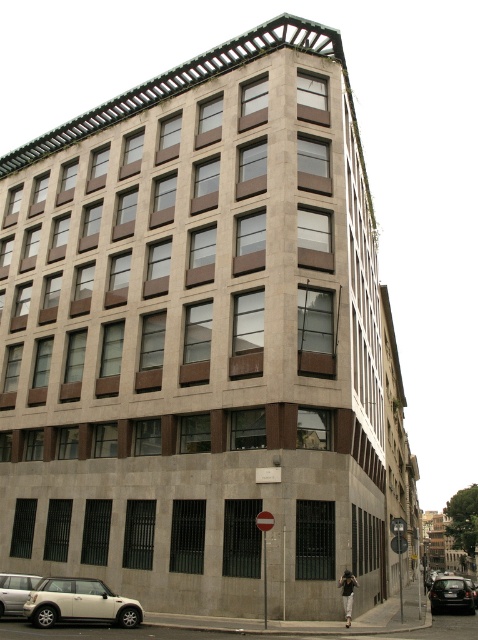
You are standing at the base of the multi story building and see the silver metallic car at lower left and the dark gray pants at lower right. Which object is nearer to you?

The silver metallic car at lower left is closer to the viewer than dark gray pants at lower right.

You are standing at the corner of the building and want to park your car. The parking spot is located at the point represented by point (14, 592). Which direction should you drive to reach the parking spot?

The parking spot is located at point (14, 592), which is at the lower left of the building. Since you are at the corner, you should drive towards the lower left direction to reach the parking spot.